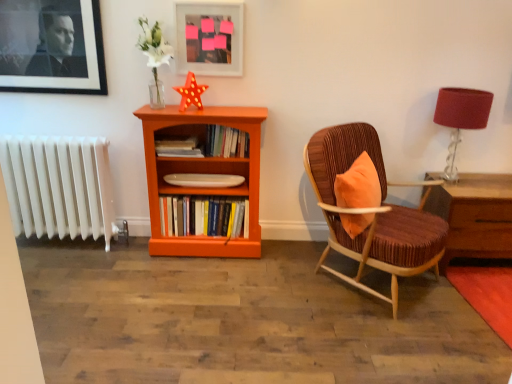
Question: From a real-world perspective, is white plastic radiator at left positioned above or below hardcover books at center, the third book from the top?

Choices:
 (A) above
 (B) below

Answer: (A)

Question: In terms of size, does white plastic radiator at left appear bigger or smaller than hardcover books at center, positioned as the first book in bottom-to-top order?

Choices:
 (A) small
 (B) big

Answer: (B)

Question: Which object is the farthest from the matte white picture frame at upper center, placed as the 2th picture frame when sorted from left to right?

Choices:
 (A) matte red lampshade at right
 (B) velvet brown armchair at right
 (C) hardcover books at center, positioned as the 2th book in top-to-bottom order
 (D) orange wood bookcase at center
 (E) hardcover books at center, positioned as the first book in bottom-to-top order

Answer: (A)

Question: Which of these objects is positioned closest to the hardcover books at center, positioned as the first book in bottom-to-top order?

Choices:
 (A) black matte picture frame at upper left, which is counted as the first picture frame, starting from the left
 (B) white plastic radiator at left
 (C) matte white picture frame at upper center, the first picture frame positioned from the right
 (D) matte red lampshade at right
 (E) hardcover books at center, the second book in the bottom-to-top sequence

Answer: (E)